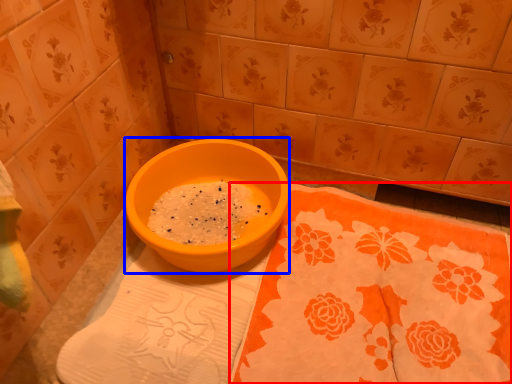
Question: Which of the following is the farthest to the observer, tablecloth (highlighted by a red box) or basin (highlighted by a blue box)?

Choices:
 (A) tablecloth
 (B) basin

Answer: (B)